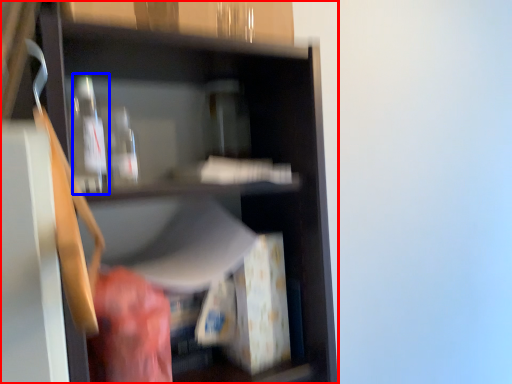
Question: Which point is closer to the camera, shelf (highlighted by a red box) or bottle (highlighted by a blue box)?

Choices:
 (A) shelf
 (B) bottle

Answer: (A)